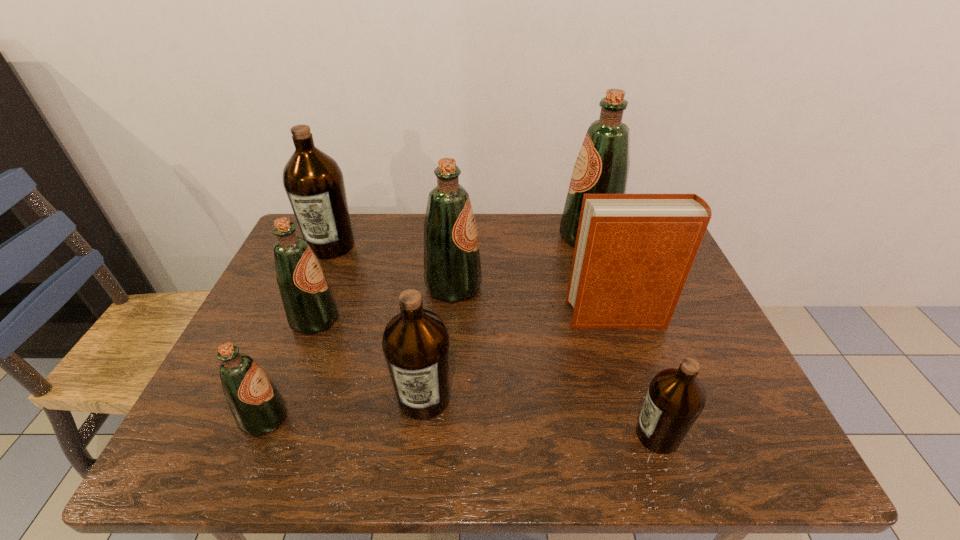
Identify the location of the rightmost green olive oil. (602, 166).

Locate an element on the screen. the tallest object is located at coordinates (602, 166).

Find the location of a particular element. the farthest brown olive oil is located at coordinates (314, 183).

At what (x,y) coordinates should I click in order to perform the action: click on the leftmost brown olive oil. Please return your answer as a coordinate pair (x, y). Looking at the image, I should click on (314, 183).

Locate an element on the screen. This screenshot has height=540, width=960. the second green olive oil from right to left is located at coordinates (452, 270).

Identify the location of hardback book. (633, 253).

This screenshot has height=540, width=960. I want to click on the third biggest green olive oil, so pos(309,304).

Identify the location of the second brown olive oil from right to left. The image size is (960, 540). (416, 344).

Locate an element on the screen. This screenshot has height=540, width=960. the nearest green olive oil is located at coordinates (258, 408).

The image size is (960, 540). In order to click on the smallest brown olive oil in this screenshot , I will do `click(675, 398)`.